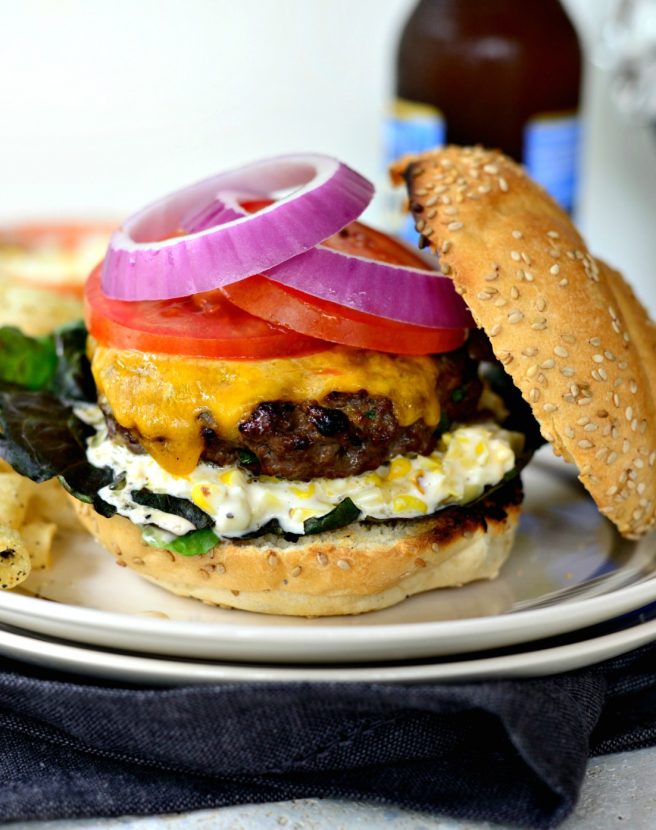
You are a GUI agent. You are given a task and a screenshot of the screen. Output one action in this format:
    pyautogui.click(x=<x>, y=<y>)
    Task: Click on the plates
    
    Given the screenshot: What is the action you would take?
    pyautogui.click(x=71, y=593), pyautogui.click(x=164, y=614), pyautogui.click(x=403, y=625), pyautogui.click(x=576, y=544), pyautogui.click(x=569, y=591)